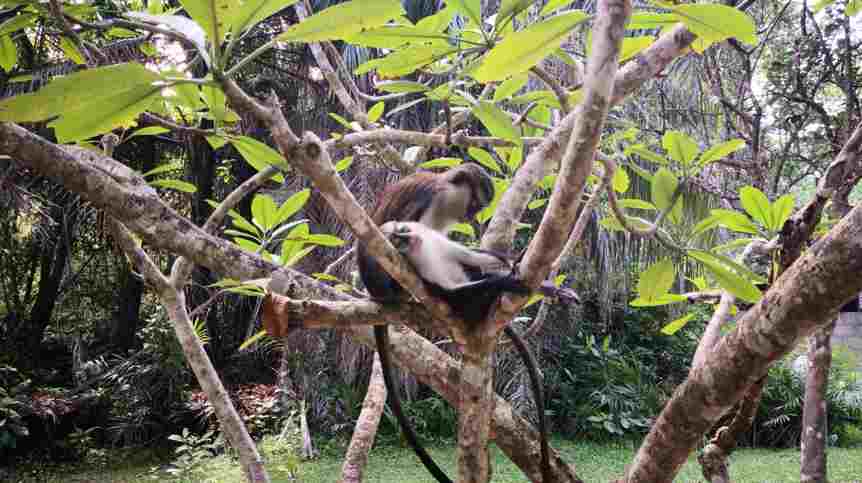
Where is `wall`? wall is located at coordinates click(848, 328).